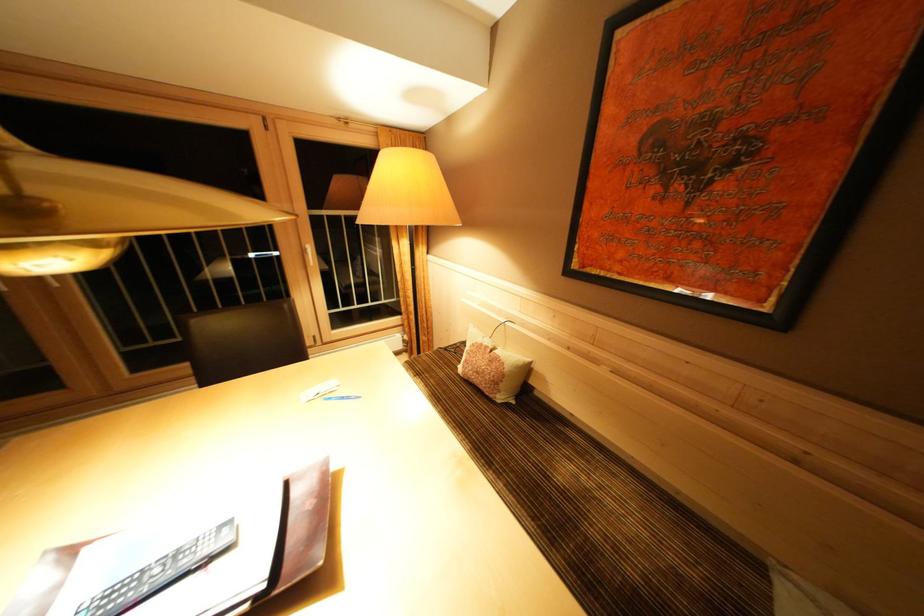
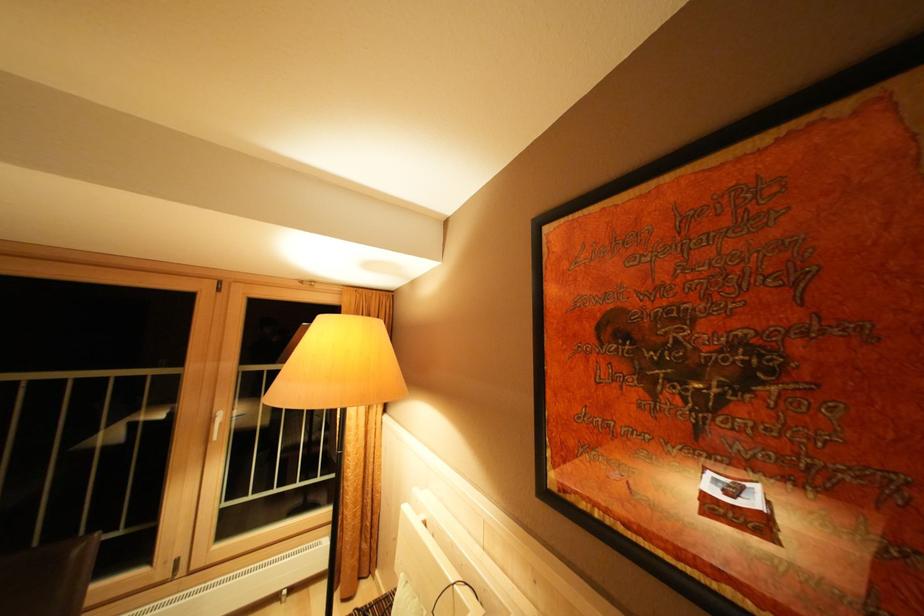
Consider the image. The images are taken continuously from a first-person perspective. In which direction are you moving?

The movement direction of the cameraman is right, forward.